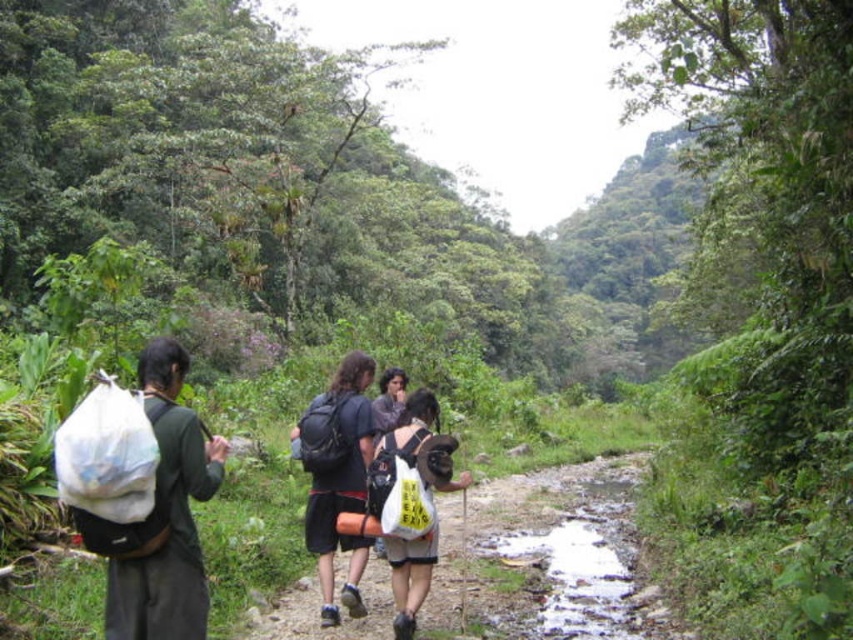
Is white fabric bag at left taller than black backpack at center?

Incorrect, white fabric bag at left's height is not larger of black backpack at center's.

Between point (169, 342) and point (344, 397), which one is positioned in front?

Point (169, 342) is in front.

Who is more forward, (148, 564) or (341, 404)?

→ Point (148, 564) is in front.

At what (x,y) coordinates should I click in order to perform the action: click on white fabric bag at left. Please return your answer as a coordinate pair (x, y). This screenshot has width=853, height=640. Looking at the image, I should click on (167, 515).

Is point (328, 477) more distant than point (428, 410)?

Yes, it is behind point (428, 410).

Can you confirm if black backpack at center is positioned above white fabric bag at center?

Correct, black backpack at center is located above white fabric bag at center.

What do you see at coordinates (337, 476) in the screenshot? I see `black backpack at center` at bounding box center [337, 476].

You are a GUI agent. You are given a task and a screenshot of the screen. Output one action in this format:
    pyautogui.click(x=<x>, y=<y>)
    Task: Click on the black backpack at center
    
    Given the screenshot: What is the action you would take?
    pyautogui.click(x=337, y=476)

Does matte plastic bag at center appear on the right side of white fabric bag at left?

Yes, matte plastic bag at center is to the right of white fabric bag at left.

Is matte plastic bag at center above white fabric bag at left?

No.

Between point (502, 534) and point (129, 560), which one is positioned behind?

Positioned behind is point (502, 534).

The height and width of the screenshot is (640, 853). I want to click on matte plastic bag at center, so click(x=544, y=560).